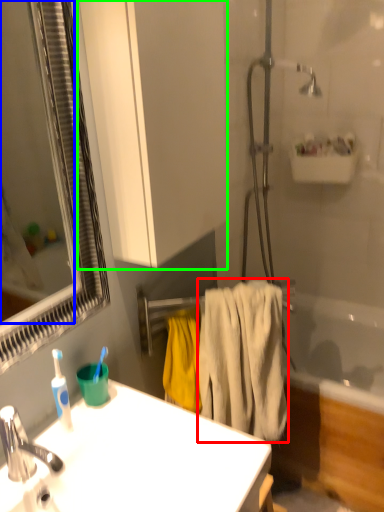
Question: Which is farther away from bath towel (highlighted by a red box)? mirror (highlighted by a blue box) or bathroom cabinet (highlighted by a green box)?

Choices:
 (A) mirror
 (B) bathroom cabinet

Answer: (A)